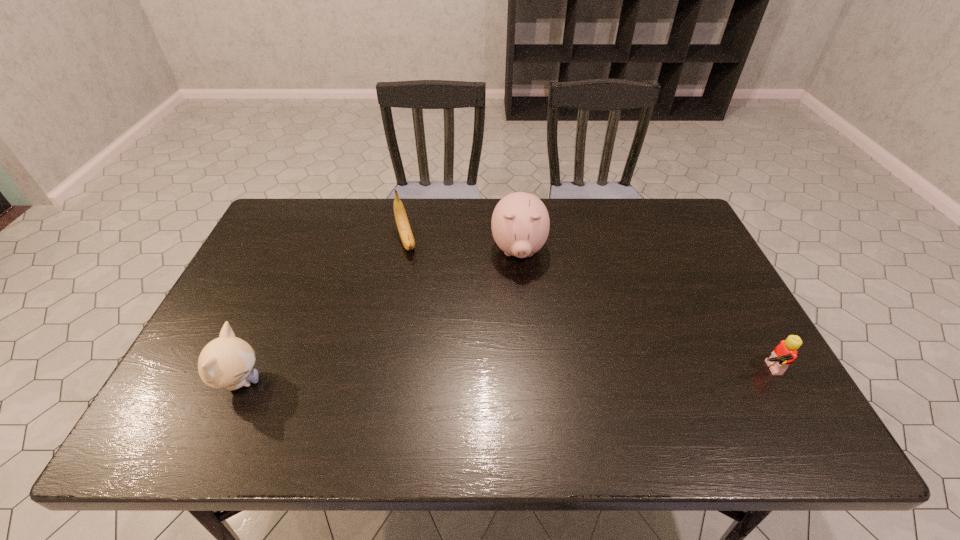
The height and width of the screenshot is (540, 960). In order to click on free space at the far edge of the desktop in this screenshot , I will do `click(359, 229)`.

In the image, there is a desktop. Where is `free space at the right edge`? The height and width of the screenshot is (540, 960). free space at the right edge is located at coordinates (681, 287).

Identify the location of free space at the far left corner of the desktop. (276, 221).

In order to click on vacant space at the near left corner of the desktop in this screenshot , I will do `click(211, 394)`.

Identify the location of vacant space at the far right corner of the desktop. (658, 238).

Where is `free space between the kitten and the banana`? This screenshot has width=960, height=540. free space between the kitten and the banana is located at coordinates (323, 312).

The image size is (960, 540). What are the coordinates of `unoccupied position between the banana and the Lego` in the screenshot? It's located at (586, 305).

You are a GUI agent. You are given a task and a screenshot of the screen. Output one action in this format:
    pyautogui.click(x=<x>, y=<y>)
    Task: Click on the empty space between the banana and the piggy bank
    
    Given the screenshot: What is the action you would take?
    pyautogui.click(x=462, y=246)

At what (x,y) coordinates should I click in order to perform the action: click on vacant space in between the shortest object and the banana. Please return your answer as a coordinate pair (x, y). The width and height of the screenshot is (960, 540). Looking at the image, I should click on (586, 305).

Where is `free spot between the leftmost object and the rightmost object`? The image size is (960, 540). free spot between the leftmost object and the rightmost object is located at coordinates (502, 375).